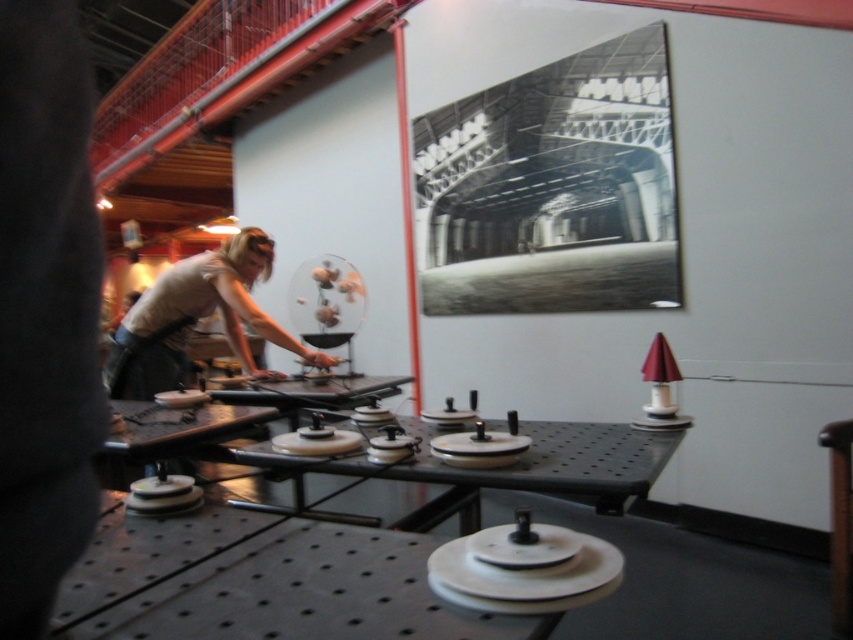
Does metallic industrial structure at upper center have a larger size compared to light beige fabric shirt at left?

Yes, metallic industrial structure at upper center is bigger than light beige fabric shirt at left.

Is point (431, 189) in front of point (219, 268)?

No, (431, 189) is behind (219, 268).

Locate an element on the screen. metallic industrial structure at upper center is located at coordinates (553, 132).